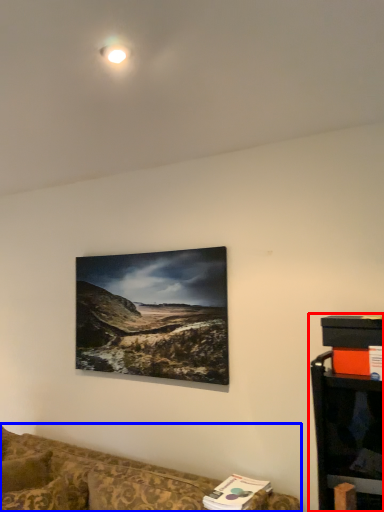
Question: Which object appears farthest to the camera in this image, entertainment center (highlighted by a red box) or studio couch (highlighted by a blue box)?

Choices:
 (A) entertainment center
 (B) studio couch

Answer: (A)